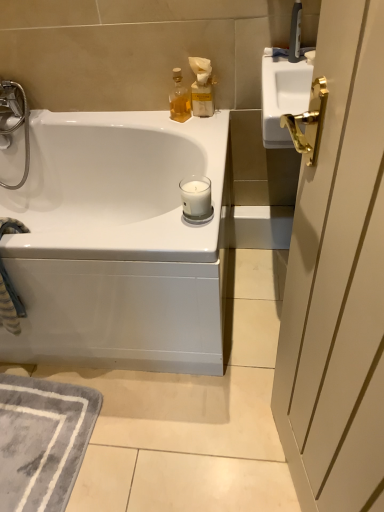
Image resolution: width=384 pixels, height=512 pixels. Identify the location of vacant area that is in front of matte beige bottle at upper right. (205, 136).